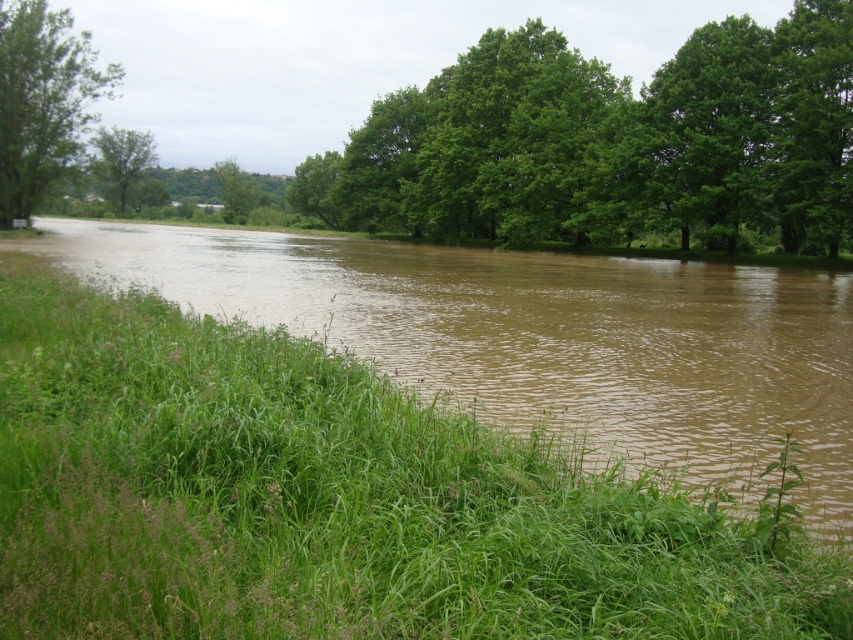
Who is shorter, green leafy tree at left or green leafy tree at center?

Standing shorter between the two is green leafy tree at left.

Between green leafy tree at left and green leafy tree at center, which one has more height?

Standing taller between the two is green leafy tree at center.

Image resolution: width=853 pixels, height=640 pixels. What do you see at coordinates (42, 100) in the screenshot?
I see `green leafy tree at left` at bounding box center [42, 100].

Identify the location of green leafy tree at left. The height and width of the screenshot is (640, 853). (42, 100).

Which is more to the left, brown muddy water at center or green leafy trees at upper center?

brown muddy water at center is more to the left.

Does brown muddy water at center come behind green leafy trees at upper center?

No, it is not.

The width and height of the screenshot is (853, 640). Describe the element at coordinates (541, 339) in the screenshot. I see `brown muddy water at center` at that location.

Find the location of `brown muddy water at center`. brown muddy water at center is located at coordinates (541, 339).

Between green leafy trees at upper center and green leafy tree at upper left, which one is positioned higher?

green leafy tree at upper left is higher up.

Where is `green leafy trees at upper center`? The width and height of the screenshot is (853, 640). green leafy trees at upper center is located at coordinates pyautogui.click(x=611, y=144).

Where is `green leafy trees at upper center`? green leafy trees at upper center is located at coordinates (611, 144).